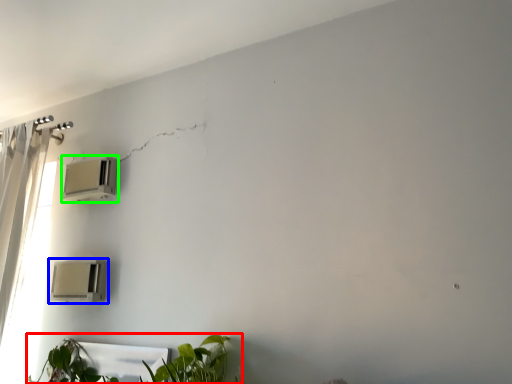
Question: Considering the real-world distances, which object is farthest from houseplant (highlighted by a red box)? air conditioning (highlighted by a blue box) or air conditioning (highlighted by a green box)?

Choices:
 (A) air conditioning
 (B) air conditioning

Answer: (B)